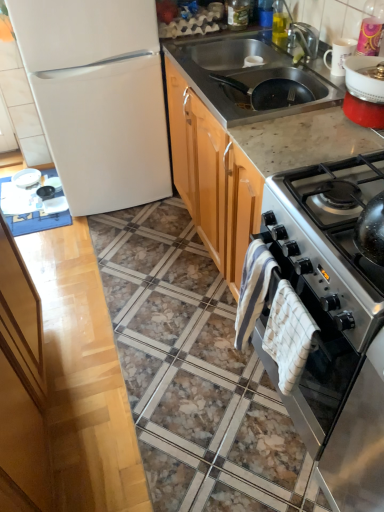
Question: From their relative heights in the image, would you say black matte frying pan at upper right is taller or shorter than marble/granite countertop at center?

Choices:
 (A) short
 (B) tall

Answer: (B)

Question: In the image, is black matte frying pan at upper right on the left side or the right side of marble/granite countertop at center?

Choices:
 (A) left
 (B) right

Answer: (B)

Question: Which of these objects is positioned farthest from the white checkered towel at right, arranged as the 2th blanket when viewed from the left?

Choices:
 (A) black matte frying pan at upper right
 (B) satin silver gas stove at right
 (C) white ceramic mug at upper right, placed as the 1th appliance when sorted from top to bottom
 (D) stainless steel sink at upper right
 (E) white matte refrigerator at left

Answer: (E)

Question: Which object is the closest to the black matte frying pan at upper right?

Choices:
 (A) stainless steel sink at upper right
 (B) satin silver gas stove at right
 (C) white ceramic mug at upper right, the 2th appliance positioned from the bottom
 (D) satin silver oven at right
 (E) white checkered towel at right, the first blanket in the right-to-left sequence

Answer: (A)